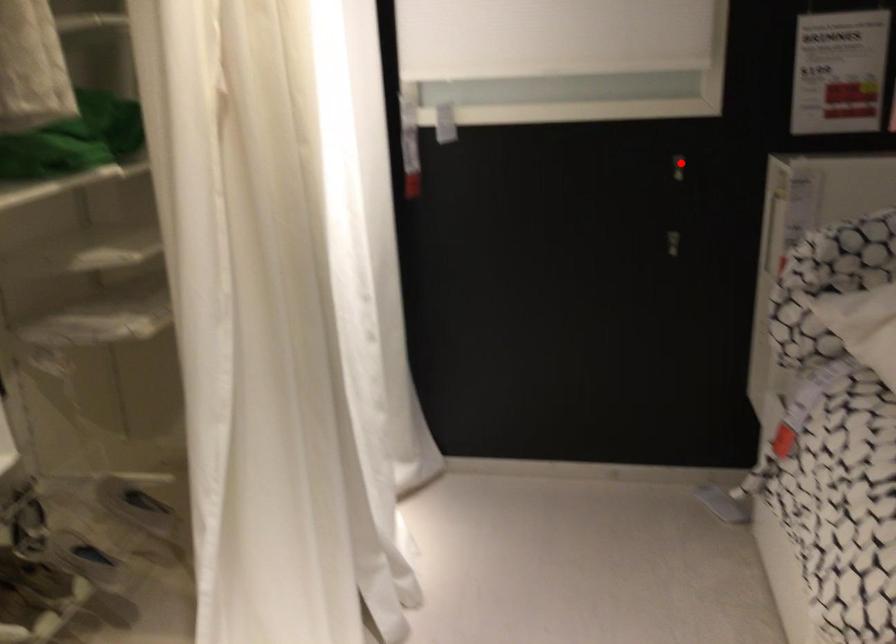
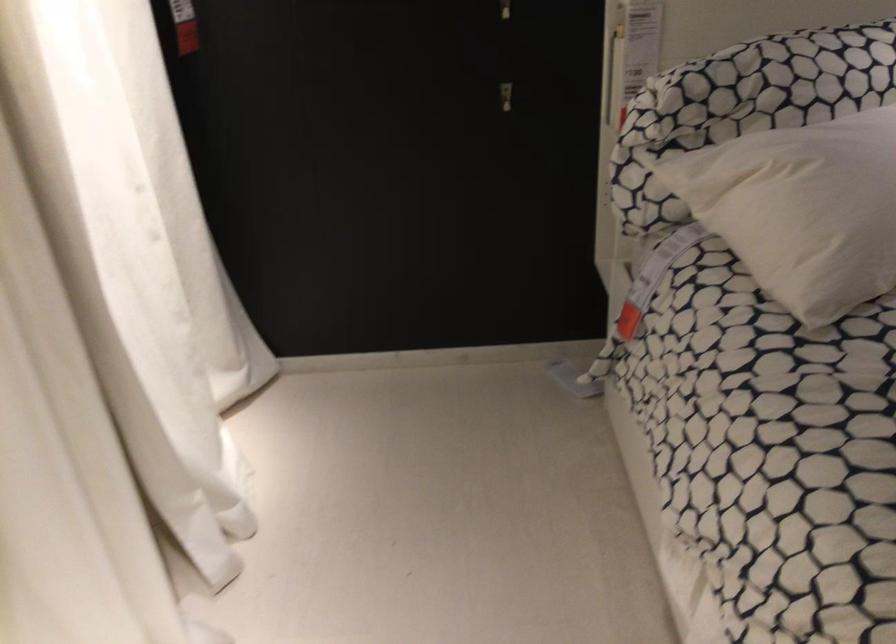
Question: I am providing you with two images of the same scene from different viewpoints. Given a red point in image1, look at the same physical point in image2. Is it:

Choices:
 (A) Closer to the viewpoint
 (B) Farther from the viewpoint

Answer: (A)